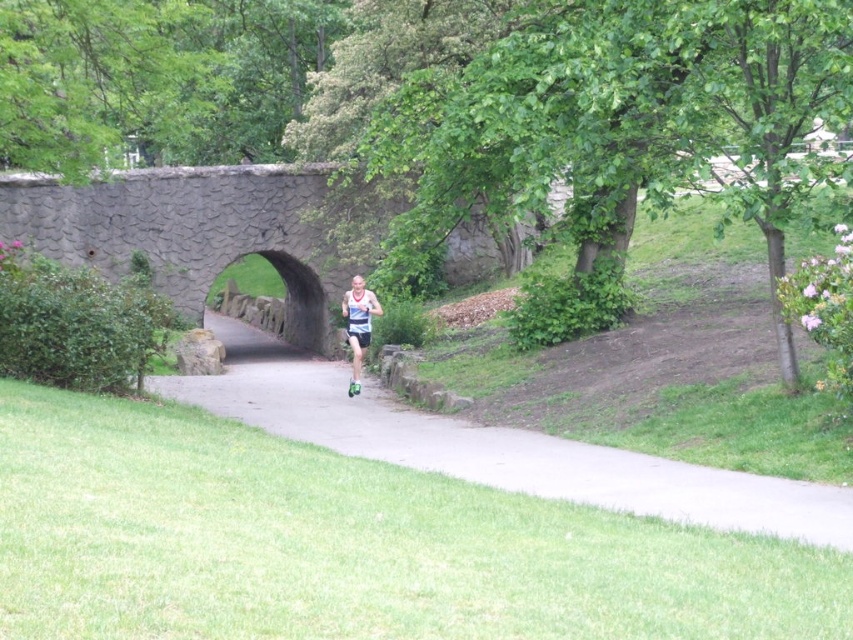
Does gray asphalt path at center have a lesser height compared to matte blue tank top at center?

In fact, gray asphalt path at center may be taller than matte blue tank top at center.

Between point (482, 476) and point (367, 339), which one is positioned in front?

Point (482, 476) is in front.

This screenshot has width=853, height=640. In order to click on gray asphalt path at center in this screenshot , I will do `click(495, 445)`.